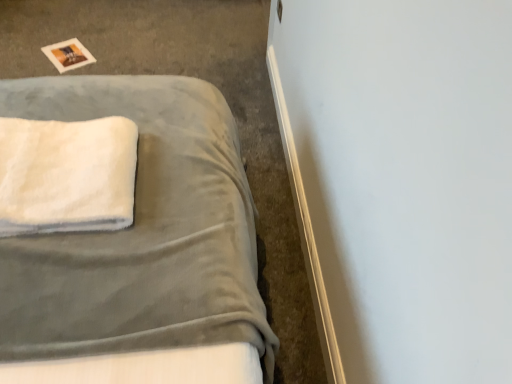
The width and height of the screenshot is (512, 384). Describe the element at coordinates (141, 233) in the screenshot. I see `suede gray bed at upper left` at that location.

You are a GUI agent. You are given a task and a screenshot of the screen. Output one action in this format:
    pyautogui.click(x=<x>, y=<y>)
    Task: Click on the suede gray bed at upper left
    
    Given the screenshot: What is the action you would take?
    pyautogui.click(x=141, y=233)

The image size is (512, 384). What do you see at coordinates (66, 175) in the screenshot?
I see `white fluffy towel at upper left` at bounding box center [66, 175].

Locate an element on the screen. white fluffy towel at upper left is located at coordinates (66, 175).

In the scene shown: In order to face white fluffy towel at upper left, should I rotate leftwards or rightwards?

Rotate your view left by about 24.685°.

You are a GUI agent. You are given a task and a screenshot of the screen. Output one action in this format:
    pyautogui.click(x=<x>, y=<y>)
    Task: Click on the suede gray bed at upper left
    Image resolution: width=512 pixels, height=384 pixels.
    Given the screenshot: What is the action you would take?
    pyautogui.click(x=141, y=233)

Would you say suede gray bed at upper left is to the left or to the right of white fluffy towel at upper left in the picture?

From the image, it's evident that suede gray bed at upper left is to the left of white fluffy towel at upper left.

Between suede gray bed at upper left and white fluffy towel at upper left, which one is positioned behind?

suede gray bed at upper left is more distant.

Which is closer, (x=148, y=115) or (x=50, y=231)?

The point (x=50, y=231) is in front.

From the picture: From the image's perspective, is suede gray bed at upper left positioned above or below white fluffy towel at upper left?

Clearly, from the image's perspective, suede gray bed at upper left is above white fluffy towel at upper left.

Consider the image. From a real-world perspective, is suede gray bed at upper left over white fluffy towel at upper left?

No, from a real-world perspective, suede gray bed at upper left is not over white fluffy towel at upper left

Does suede gray bed at upper left have a lesser width compared to white fluffy towel at upper left?

Incorrect, the width of suede gray bed at upper left is not less than that of white fluffy towel at upper left.

Considering the sizes of suede gray bed at upper left and white fluffy towel at upper left in the image, is suede gray bed at upper left taller or shorter than white fluffy towel at upper left?

In the image, suede gray bed at upper left appears to be shorter than white fluffy towel at upper left.

Can you confirm if suede gray bed at upper left is bigger than white fluffy towel at upper left?

Indeed, suede gray bed at upper left has a larger size compared to white fluffy towel at upper left.

Based on the photo, would you say suede gray bed at upper left is inside or outside white fluffy towel at upper left?

suede gray bed at upper left lies outside white fluffy towel at upper left.

Is the surface of suede gray bed at upper left in direct contact with white fluffy towel at upper left?

suede gray bed at upper left and white fluffy towel at upper left are not in contact.

Is suede gray bed at upper left oriented towards white fluffy towel at upper left?

No, suede gray bed at upper left does not turn towards white fluffy towel at upper left.

What's the angular difference between suede gray bed at upper left and white fluffy towel at upper left's facing directions?

The angle between the facing direction of suede gray bed at upper left and the facing direction of white fluffy towel at upper left is 178 degrees.

Locate an element on the screen. The image size is (512, 384). bed that is under the white fluffy towel at upper left (from a real-world perspective) is located at coordinates (141, 233).

Which is more to the right, white fluffy towel at upper left or suede gray bed at upper left?

From the viewer's perspective, white fluffy towel at upper left appears more on the right side.

Relative to suede gray bed at upper left, is white fluffy towel at upper left in front or behind?

Visually, white fluffy towel at upper left is located in front of suede gray bed at upper left.

Is point (134, 125) closer or farther from the camera than point (113, 337)?

Point (134, 125) is farther from the camera than point (113, 337).

From the image's perspective, is white fluffy towel at upper left below suede gray bed at upper left?

Indeed, from the image's perspective, white fluffy towel at upper left is shown beneath suede gray bed at upper left.

From a real-world perspective, who is located higher, white fluffy towel at upper left or suede gray bed at upper left?

white fluffy towel at upper left is physically above.

Does white fluffy towel at upper left have a greater width compared to suede gray bed at upper left?

No.

Can you confirm if white fluffy towel at upper left is taller than suede gray bed at upper left?

Yes, white fluffy towel at upper left is taller than suede gray bed at upper left.

Based on the photo, between white fluffy towel at upper left and suede gray bed at upper left, which one has larger size?

suede gray bed at upper left is bigger.

Would you say white fluffy towel at upper left is inside or outside suede gray bed at upper left?

white fluffy towel at upper left lies outside suede gray bed at upper left.

Is white fluffy towel at upper left in contact with suede gray bed at upper left?

There is a gap between white fluffy towel at upper left and suede gray bed at upper left.

Is white fluffy towel at upper left oriented towards suede gray bed at upper left?

No, white fluffy towel at upper left does not turn towards suede gray bed at upper left.

Where is `towel above the suede gray bed at upper left (from a real-world perspective)`? towel above the suede gray bed at upper left (from a real-world perspective) is located at coordinates (66, 175).

Locate an element on the screen. This screenshot has height=384, width=512. towel above the suede gray bed at upper left (from a real-world perspective) is located at coordinates (66, 175).

Where is `towel below the suede gray bed at upper left (from the image's perspective)`? The width and height of the screenshot is (512, 384). towel below the suede gray bed at upper left (from the image's perspective) is located at coordinates (66, 175).